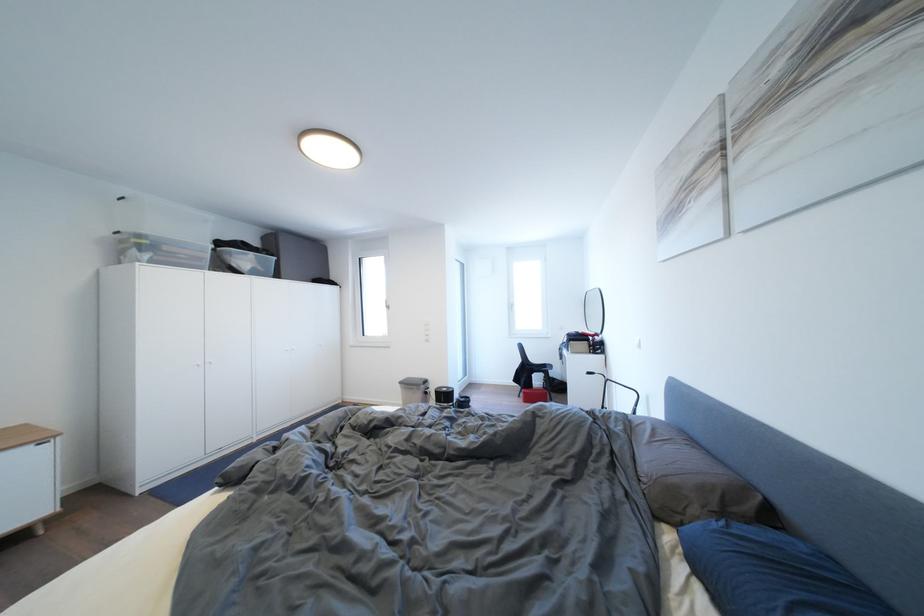
You are a GUI agent. You are given a task and a screenshot of the screen. Output one action in this format:
    pyautogui.click(x=<x>, y=<y>)
    Task: Click on the oval mirror
    The height and width of the screenshot is (616, 924).
    Given the screenshot: What is the action you would take?
    pyautogui.click(x=593, y=310)